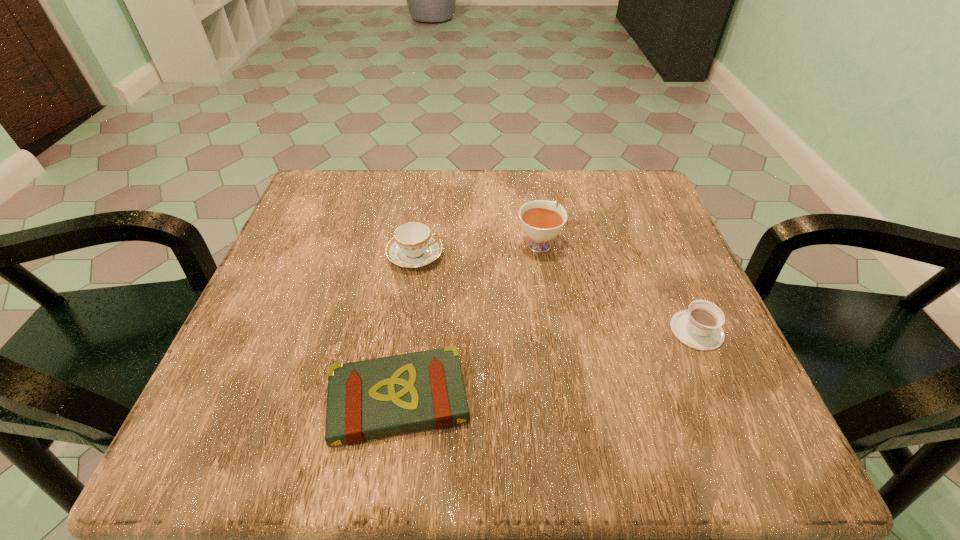
Image resolution: width=960 pixels, height=540 pixels. Find the location of `free location that satisfies the following two spatial constraints: 1. on the side with the handle of the nearest object; 2. on the right side of the leftmost teacup`. free location that satisfies the following two spatial constraints: 1. on the side with the handle of the nearest object; 2. on the right side of the leftmost teacup is located at coordinates (393, 400).

Where is `free space in the image that satisfies the following two spatial constraints: 1. on the side with the handle of the second tallest object; 2. on the handle side of the rightmost teacup`? The height and width of the screenshot is (540, 960). free space in the image that satisfies the following two spatial constraints: 1. on the side with the handle of the second tallest object; 2. on the handle side of the rightmost teacup is located at coordinates (403, 330).

In order to click on vacant space that satisfies the following two spatial constraints: 1. on the side with the handle of the second tallest teacup; 2. on the handle side of the rightmost teacup in this screenshot , I will do `click(403, 330)`.

Where is `free space that satisfies the following two spatial constraints: 1. on the side with the handle of the third shortest object; 2. on the handle side of the rightmost object`? The width and height of the screenshot is (960, 540). free space that satisfies the following two spatial constraints: 1. on the side with the handle of the third shortest object; 2. on the handle side of the rightmost object is located at coordinates [403, 330].

You are a GUI agent. You are given a task and a screenshot of the screen. Output one action in this format:
    pyautogui.click(x=<x>, y=<y>)
    Task: Click on the vacant area that satisfies the following two spatial constraints: 1. on the back side of the shortest object; 2. on the side with the handle of the second tallest teacup
    
    Given the screenshot: What is the action you would take?
    pyautogui.click(x=420, y=255)

The height and width of the screenshot is (540, 960). What are the coordinates of `vacant space that satisfies the following two spatial constraints: 1. on the back side of the nearest object; 2. on the side with the handle of the third shortest object` in the screenshot? It's located at (420, 255).